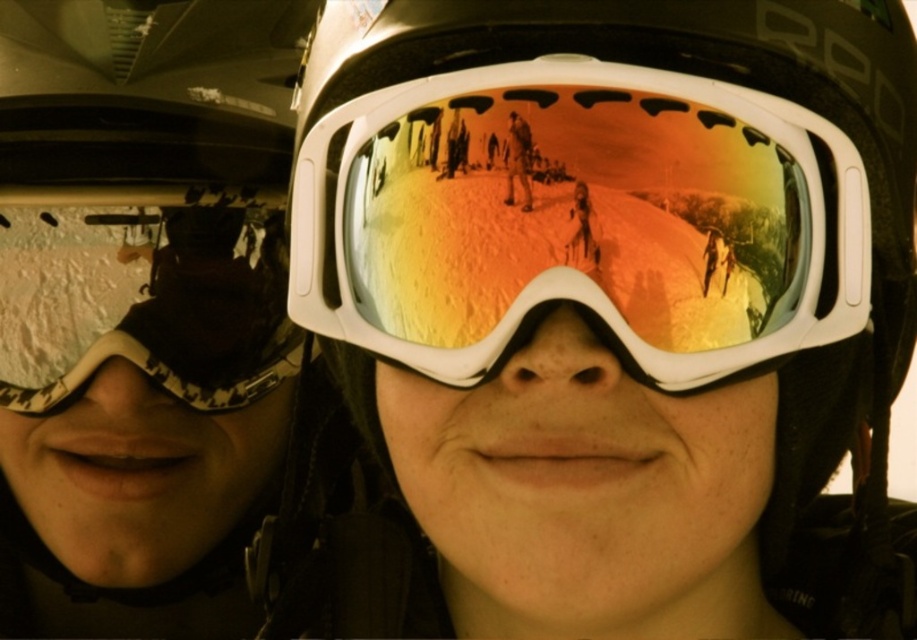
You are trying to decide which pair of goggles to buy based on their size. The store has both the white reflective lens at center and the matte black goggles at left. According to the image, which one has a wider lens?

The white reflective lens at center has a wider lens than the matte black goggles at left.

You are trying to take a photo of the white reflective lens at center and the matte black goggles at left. Which object should you focus on first if you want both to be in sharp focus?

The white reflective lens at center is in front of the matte black goggles at left, so you should focus on the white reflective lens at center first to ensure both are in sharp focus.

You are trying to take a photo of the white reflective lens at center and the matte black goggles at left. Based on their positions, which object should you focus on first if you want to capture both in one shot without moving the camera?

You should focus on the matte black goggles at left first because the white reflective lens at center is to the right of it, so keeping both in frame requires starting from the leftmost object.